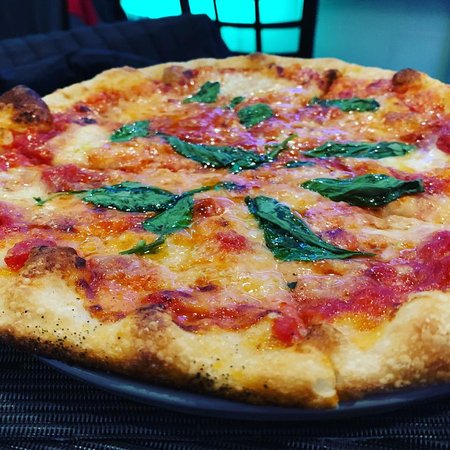
Find the location of a particular element. The image size is (450, 450). window is located at coordinates (264, 25).